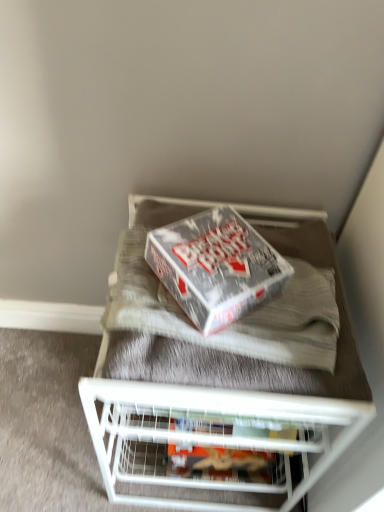
This screenshot has width=384, height=512. What are the coordinates of `vacant space situated on the left part of white metal shelf at upper center` in the screenshot? It's located at (50, 411).